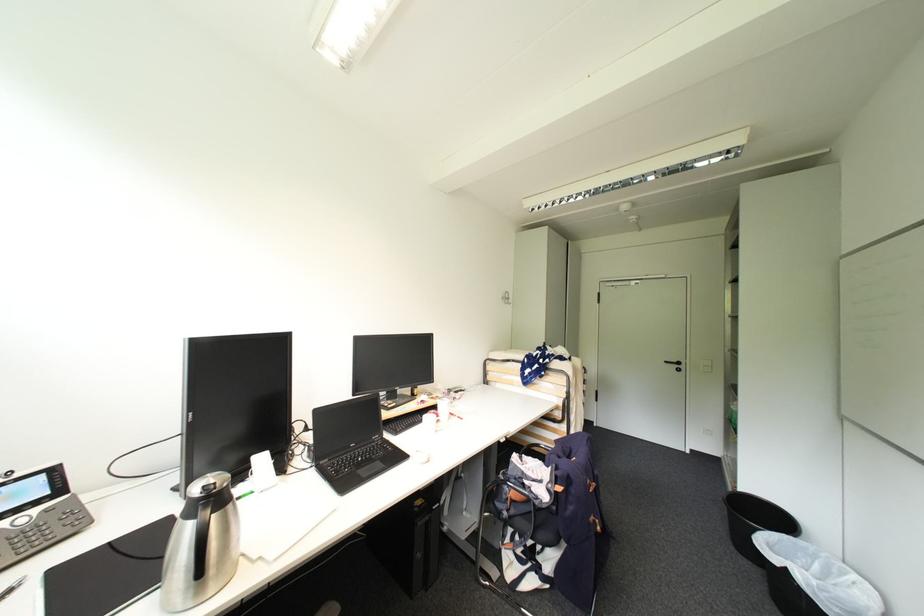
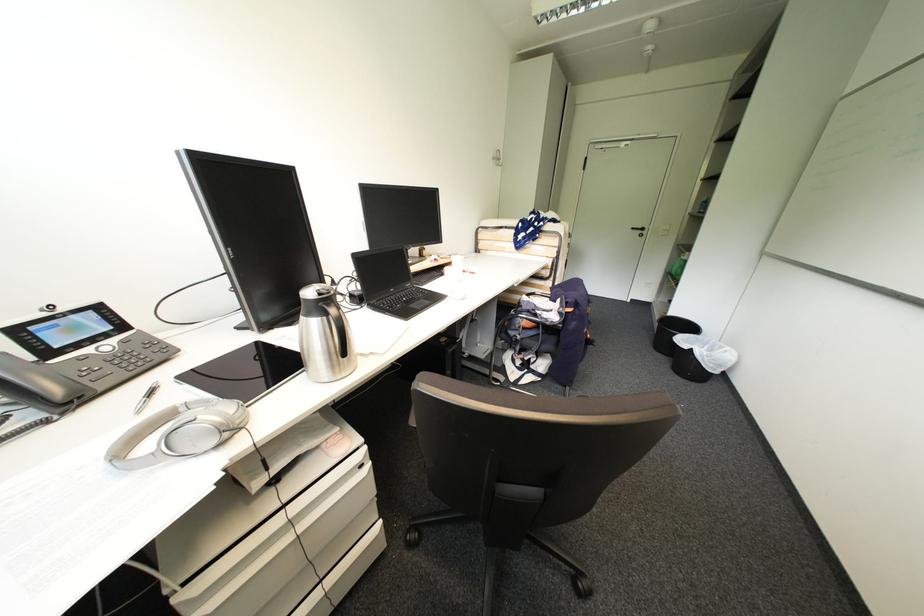
Locate, in the second image, the point that corresponds to pixel 740 549 in the first image.

(660, 351)